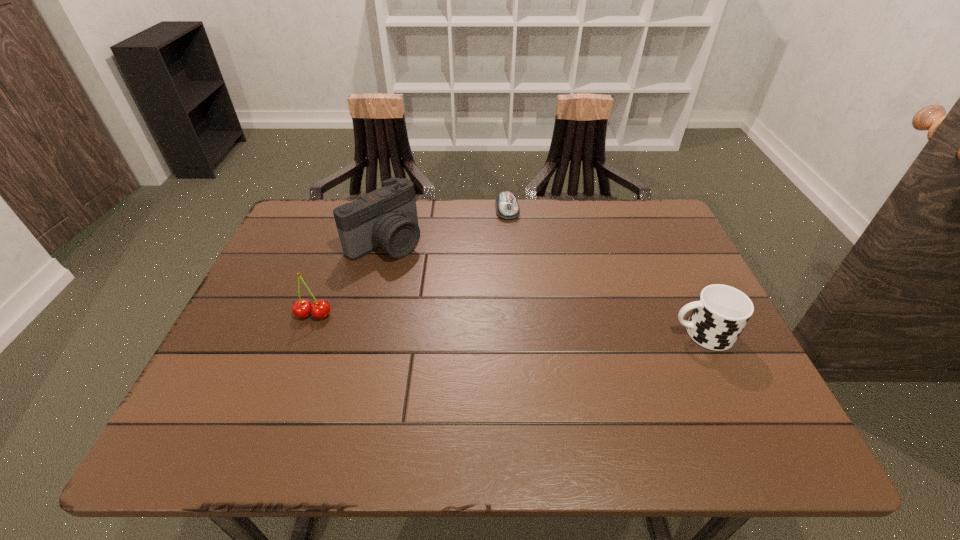
This screenshot has height=540, width=960. I want to click on vacant space that satisfies the following two spatial constraints: 1. on the front side of the third object from left to right; 2. on the side of the cup with the handle, so click(517, 333).

This screenshot has height=540, width=960. I want to click on free point that satisfies the following two spatial constraints: 1. with the stems of the cherry pointing upwards; 2. on the side of the rightmost object with the handle, so click(x=307, y=333).